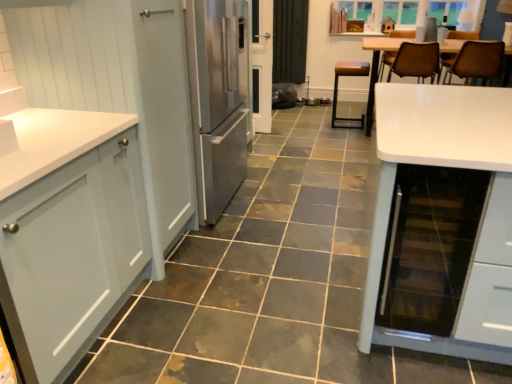
The image size is (512, 384). Describe the element at coordinates (480, 217) in the screenshot. I see `white glossy table at right` at that location.

How much space does brown leather stool at center, acting as the third chair starting from the right, occupy vertically?

brown leather stool at center, acting as the third chair starting from the right, is 27.17 inches tall.

I want to click on matte white cabinet at left, the 1th cabinetry viewed from the back, so click(x=118, y=84).

Image resolution: width=512 pixels, height=384 pixels. In order to click on white glossy table at right in this screenshot , I will do `click(480, 217)`.

Is black glass wine cooler at right not within white glossy table at right?

No, black glass wine cooler at right is not outside of white glossy table at right.

From a real-world perspective, is black glass wine cooler at right located higher than white glossy table at right?

Incorrect, from a real-world perspective, black glass wine cooler at right is lower than white glossy table at right.

Which object is thinner, black glass wine cooler at right or white glossy table at right?

black glass wine cooler at right.

In the scene shown: Measure the distance between white glossy table at right and brown leather stool at center, acting as the third chair starting from the right.

They are 9.10 feet apart.

Which object is further away from the camera, white glossy table at right or brown leather stool at center, which appears as the 1th chair when viewed from the left?

brown leather stool at center, which appears as the 1th chair when viewed from the left.

Considering the relative sizes of white glossy table at right and brown leather stool at center, which appears as the 1th chair when viewed from the left, in the image provided, is white glossy table at right shorter than brown leather stool at center, which appears as the 1th chair when viewed from the left,?

Incorrect, the height of white glossy table at right does not fall short of that of brown leather stool at center, which appears as the 1th chair when viewed from the left.

Between white glossy table at right and brown leather stool at center, which appears as the 1th chair when viewed from the left, which one has smaller width?

Thinner between the two is brown leather stool at center, which appears as the 1th chair when viewed from the left.

What's the angular difference between white glossy screen door at center and matte white cabinet at left, the 1th cabinetry viewed from the back,'s facing directions?

There is a 94.4-degree angle between the facing directions of white glossy screen door at center and matte white cabinet at left, the 1th cabinetry viewed from the back.

Based on the photo, which object is positioned more to the right, white glossy screen door at center or matte white cabinet at left, the 1th cabinetry viewed from the back?

white glossy screen door at center.

Are white glossy screen door at center and matte white cabinet at left, the 1th cabinetry viewed from the back, far apart?

Yes.

From the image's perspective, is white glossy screen door at center over matte white cabinet at left, the 1th cabinetry viewed from the back?

Yes, from the image's perspective, white glossy screen door at center is above matte white cabinet at left, the 1th cabinetry viewed from the back.

Is brown leather chair at upper right, which is counted as the first chair, starting from the right, turned away from brown leather stool at center, which appears as the 1th chair when viewed from the left?

No, brown leather stool at center, which appears as the 1th chair when viewed from the left, is not at the back of brown leather chair at upper right, which is counted as the first chair, starting from the right.

Is the surface of brown leather chair at upper right, which is counted as the first chair, starting from the right, in direct contact with brown leather stool at center, acting as the third chair starting from the right?

No, brown leather chair at upper right, which is counted as the first chair, starting from the right, is not in contact with brown leather stool at center, acting as the third chair starting from the right.

Is point (498, 67) closer to viewer compared to point (337, 76)?

Yes, point (498, 67) is in front of point (337, 76).

Is the position of brown leather chair at upper right, which is counted as the first chair, starting from the right, more distant than that of brown leather stool at center, acting as the third chair starting from the right?

No, brown leather chair at upper right, which is counted as the first chair, starting from the right, is in front of brown leather stool at center, acting as the third chair starting from the right.

Which is closer, [450,99] or [420,197]?

Point [450,99] is farther from the camera than point [420,197].

From the image's perspective, is white glossy table at right on black glass wine cooler at right?

Yes, from the image's perspective, white glossy table at right is above black glass wine cooler at right.

This screenshot has width=512, height=384. Identify the location of appliance behind the white glossy table at right. (429, 247).

Between white glossy table at right and black glass wine cooler at right, which one has smaller width?

Thinner between the two is black glass wine cooler at right.

Is brown leather stool at center, acting as the third chair starting from the right, at the back of matte white cabinet at left, the 1th cabinetry viewed from the back?

No, matte white cabinet at left, the 1th cabinetry viewed from the back, is not facing away from brown leather stool at center, acting as the third chair starting from the right.

Is point (48, 21) in front of point (361, 66)?

Yes, point (48, 21) is in front of point (361, 66).

Can you confirm if matte white cabinet at left, the second cabinetry when ordered from front to back, is positioned to the left of brown leather stool at center, acting as the third chair starting from the right?

Yes.

Is the position of matte white cabinet at left, the second cabinetry when ordered from front to back, less distant than that of brown leather stool at center, acting as the third chair starting from the right?

Yes, matte white cabinet at left, the second cabinetry when ordered from front to back, is closer to the camera.

Considering the relative sizes of brown leather stool at center, acting as the third chair starting from the right, and matte white cabinet at left, the 1th cabinetry viewed from the back, in the image provided, is brown leather stool at center, acting as the third chair starting from the right, smaller than matte white cabinet at left, the 1th cabinetry viewed from the back,?

Indeed, brown leather stool at center, acting as the third chair starting from the right, has a smaller size compared to matte white cabinet at left, the 1th cabinetry viewed from the back.

Considering the sizes of objects brown leather stool at center, which appears as the 1th chair when viewed from the left, and matte white cabinet at left, the second cabinetry when ordered from front to back, in the image provided, who is thinner, brown leather stool at center, which appears as the 1th chair when viewed from the left, or matte white cabinet at left, the second cabinetry when ordered from front to back,?

Thinner between the two is brown leather stool at center, which appears as the 1th chair when viewed from the left.

Considering their positions, is brown leather stool at center, acting as the third chair starting from the right, located in front of or behind matte white cabinet at left, the second cabinetry when ordered from front to back?

In the image, brown leather stool at center, acting as the third chair starting from the right, appears behind matte white cabinet at left, the second cabinetry when ordered from front to back.

This screenshot has height=384, width=512. Identify the location of chair that is the 3rd one when counting backward from the matte white cabinet at left, the second cabinetry when ordered from front to back. (337, 87).

Where is `table located above the black glass wine cooler at right (from the image's perspective)`? table located above the black glass wine cooler at right (from the image's perspective) is located at coordinates (480, 217).

The height and width of the screenshot is (384, 512). I want to click on chair below the white glossy table at right (from a real-world perspective), so click(337, 87).

Considering their positions, is matte white cabinet at left, the second cabinetry when ordered from front to back, positioned further to brown leather stool at center, which appears as the 1th chair when viewed from the left, than brown leather chair at upper right, the 2th chair viewed from the left?

Among the two, matte white cabinet at left, the second cabinetry when ordered from front to back, is located further to brown leather stool at center, which appears as the 1th chair when viewed from the left.

From the image, which object appears to be farther from white glossy screen door at center, brown leather chair at upper right, placed as the third chair when sorted from left to right, or matte white cabinet at left, the second cabinetry when ordered from front to back?

matte white cabinet at left, the second cabinetry when ordered from front to back, is further to white glossy screen door at center.

Estimate the real-world distances between objects in this image. Which object is further from brown leather chair at upper right, which is counted as the first chair, starting from the right, white glossy table at right or black glass wine cooler at right?

Among the two, black glass wine cooler at right is located further to brown leather chair at upper right, which is counted as the first chair, starting from the right.

Based on their spatial positions, is white glossy screen door at center or brown leather chair at upper right, the 2th chair viewed from the left, closer to black glass wine cooler at right?

brown leather chair at upper right, the 2th chair viewed from the left, is positioned closer to the anchor black glass wine cooler at right.

Consider the image. When comparing their distances from brown leather stool at center, which appears as the 1th chair when viewed from the left, does black glass wine cooler at right or matte gray cabinet at left, which ranks as the 2th cabinetry in back-to-front order, seem further?

The object further to brown leather stool at center, which appears as the 1th chair when viewed from the left, is matte gray cabinet at left, which ranks as the 2th cabinetry in back-to-front order.

When comparing their distances from white glossy table at right, does black glass wine cooler at right or brown leather stool at center, acting as the third chair starting from the right, seem closer?

black glass wine cooler at right.

Which object lies nearer to the anchor point white glossy table at right, brown leather chair at upper right, which is counted as the first chair, starting from the right, or brown leather chair at upper right, the 2th chair viewed from the left?

brown leather chair at upper right, which is counted as the first chair, starting from the right, is closer to white glossy table at right.

From the image, which object appears to be farther from matte gray cabinet at left, which is the first cabinetry from front to back, brown leather chair at upper right, which is counted as the first chair, starting from the right, or brown leather stool at center, acting as the third chair starting from the right?

brown leather stool at center, acting as the third chair starting from the right, is further to matte gray cabinet at left, which is the first cabinetry from front to back.

What are the coordinates of `cabinetry between white glossy table at right and brown leather chair at upper right, positioned as the second chair in right-to-left order, from front to back` in the screenshot? It's located at (118, 84).

Where is `appliance between matte gray cabinet at left, which ranks as the 2th cabinetry in back-to-front order, and white glossy screen door at center, along the z-axis`? The image size is (512, 384). appliance between matte gray cabinet at left, which ranks as the 2th cabinetry in back-to-front order, and white glossy screen door at center, along the z-axis is located at coordinates (429, 247).

This screenshot has width=512, height=384. Find the location of `table between matte gray cabinet at left, which is the first cabinetry from front to back, and brown leather stool at center, acting as the third chair starting from the right, along the z-axis`. table between matte gray cabinet at left, which is the first cabinetry from front to back, and brown leather stool at center, acting as the third chair starting from the right, along the z-axis is located at coordinates (480, 217).

The height and width of the screenshot is (384, 512). Find the location of `appliance between matte gray cabinet at left, which is the first cabinetry from front to back, and brown leather chair at upper right, placed as the third chair when sorted from left to right, from left to right`. appliance between matte gray cabinet at left, which is the first cabinetry from front to back, and brown leather chair at upper right, placed as the third chair when sorted from left to right, from left to right is located at coordinates (429, 247).